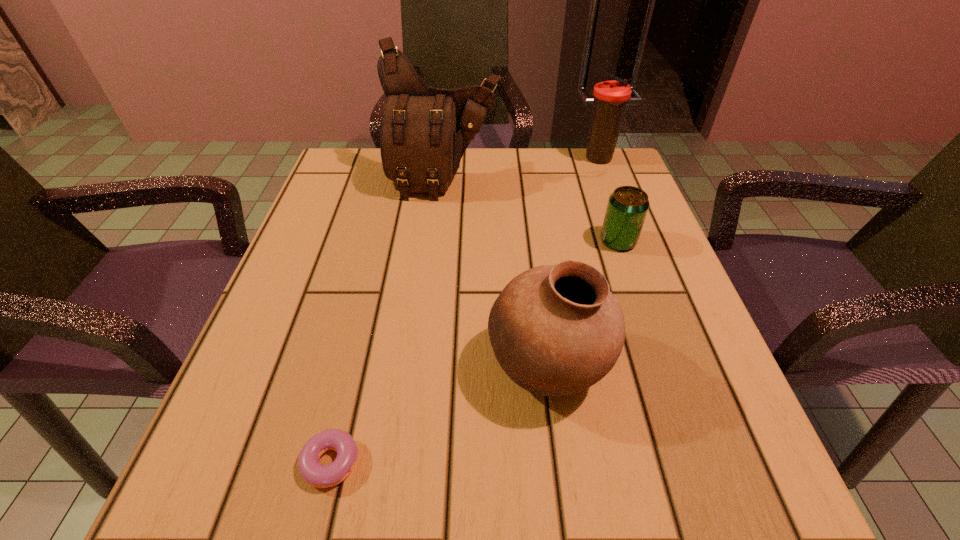
You are a GUI agent. You are given a task and a screenshot of the screen. Output one action in this format:
    pyautogui.click(x=<x>, y=<y>)
    Task: Click on the vacant space located 0.320m on the back of the beer can
    The image size is (960, 540).
    Given the screenshot: What is the action you would take?
    pyautogui.click(x=588, y=152)

Where is `vacant space situated on the right of the nearest object`? This screenshot has height=540, width=960. vacant space situated on the right of the nearest object is located at coordinates (397, 462).

The width and height of the screenshot is (960, 540). I want to click on shoulder bag at the far edge, so click(x=425, y=131).

Where is `thermos bottle positioned at the far edge`? The width and height of the screenshot is (960, 540). thermos bottle positioned at the far edge is located at coordinates (611, 97).

The height and width of the screenshot is (540, 960). Identify the location of object that is at the near edge. (315, 474).

Identify the location of shoulder bag that is at the left edge. (425, 131).

At what (x,y) coordinates should I click in order to perform the action: click on doughnut positioned at the left edge. Please return your answer as a coordinate pair (x, y). This screenshot has height=540, width=960. Looking at the image, I should click on pos(315,474).

At what (x,y) coordinates should I click in order to perform the action: click on thermos bottle that is at the right edge. Please return your answer as a coordinate pair (x, y). This screenshot has height=540, width=960. Looking at the image, I should click on (611, 97).

The height and width of the screenshot is (540, 960). I want to click on beer can present at the right edge, so click(627, 208).

What are the coordinates of `object that is positioned at the far left corner` in the screenshot? It's located at (425, 131).